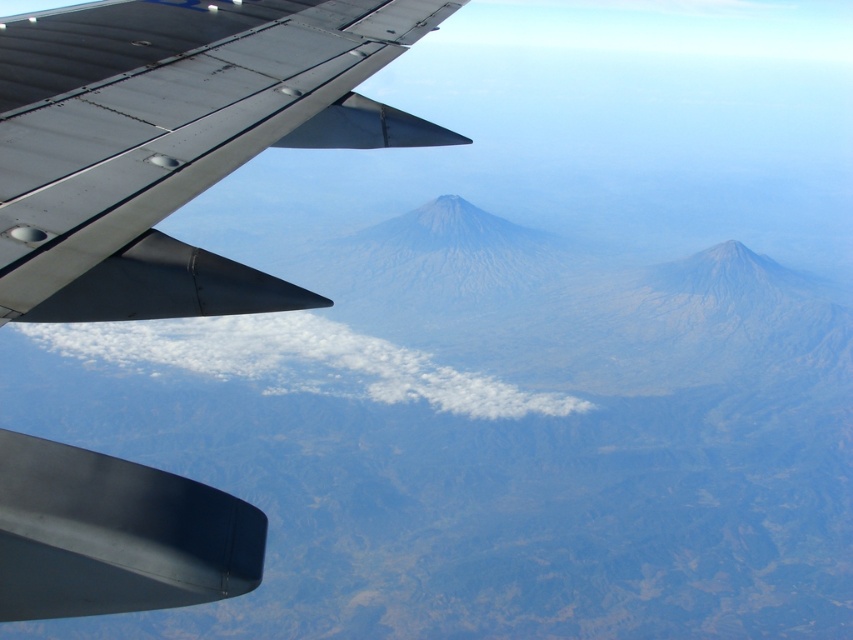
In the scene shown: Can you confirm if gray/dull rock mountain range at center is positioned above metallic gray wing at upper left?

No, gray/dull rock mountain range at center is not above metallic gray wing at upper left.

Can you confirm if gray/dull rock mountain range at center is bigger than metallic gray wing at upper left?

Yes.

The image size is (853, 640). What do you see at coordinates (490, 436) in the screenshot?
I see `gray/dull rock mountain range at center` at bounding box center [490, 436].

Identify the location of gray/dull rock mountain range at center. (490, 436).